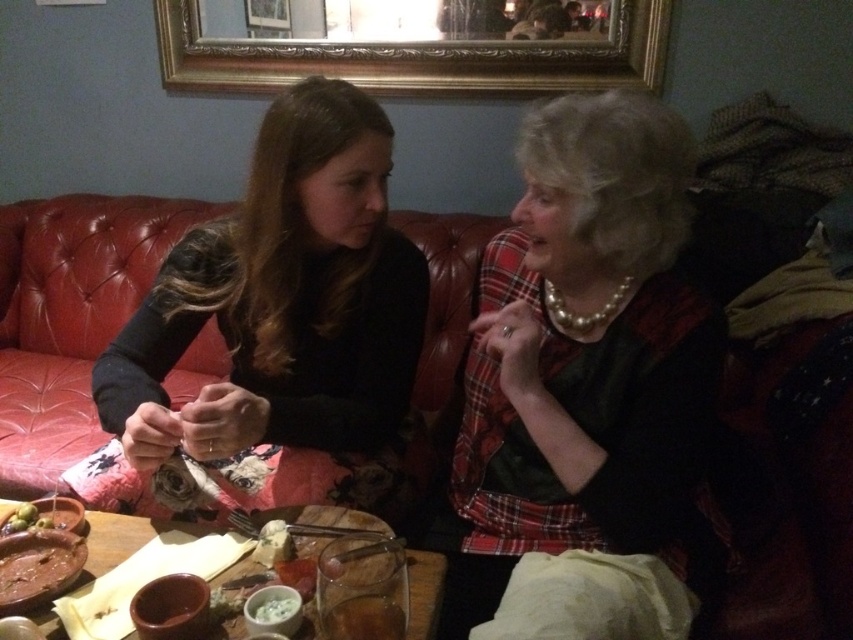
You are standing at the entrance of the restaurant and want to walk directly to the point marked by the coordinates point (517, 461) and point (4, 593). Which coordinate point should you aim for first if you want to reach the one that is farther away from the entrance?

You should aim for point (517, 461) first because it is farther away from the entrance than point (4, 593).

You are a server at the restaurant. You need to place a new order of soup on the table. The soup bowl is taller than the brown glossy plate at lower left. Can you place it on the wooden table at center without it touching the existing items?

The wooden table at center is much taller as brown glossy plate at lower left. Since the soup bowl is taller than the brown glossy plate at lower left, it should fit on the wooden table at center without issue, as the table is already elevated enough to accommodate taller items.